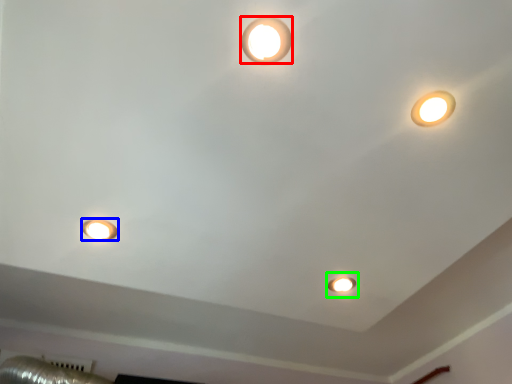
Question: Based on their relative distances, which object is farther from lamp (highlighted by a red box)? Choose from lamp (highlighted by a blue box) and stage light (highlighted by a green box).

Choices:
 (A) lamp
 (B) stage light

Answer: (B)